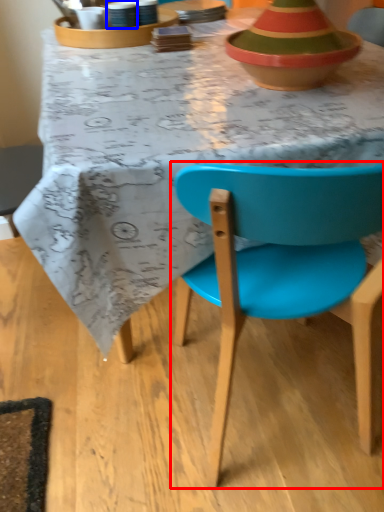
Question: Which point is further to the camera, chair (highlighted by a red box) or tableware (highlighted by a blue box)?

Choices:
 (A) chair
 (B) tableware

Answer: (B)